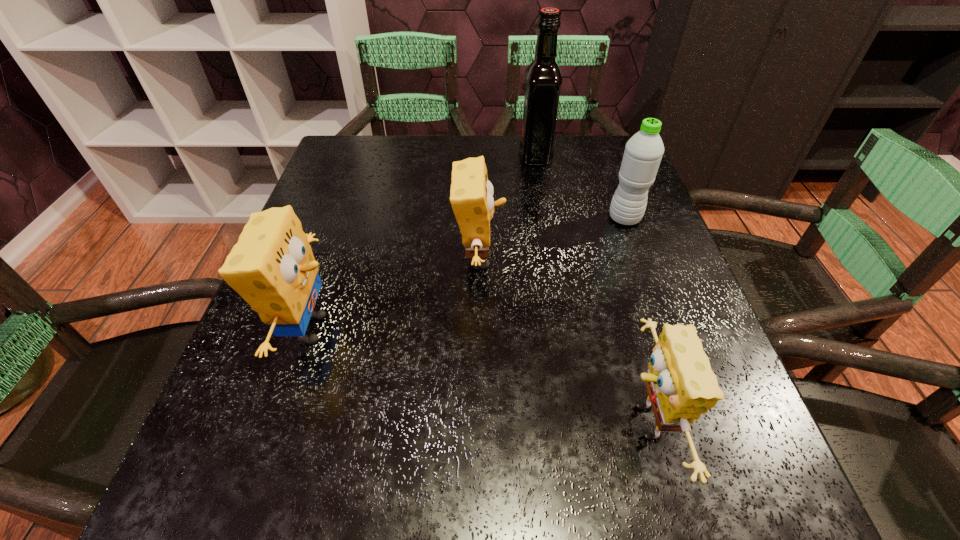
Locate an element on the screen. This screenshot has height=540, width=960. blank region between the rightmost sponge and the fourth object from right to left is located at coordinates (562, 341).

Where is `unoccupied position between the liquor and the shortest sponge`? unoccupied position between the liquor and the shortest sponge is located at coordinates (589, 289).

At what (x,y) coordinates should I click in order to perform the action: click on free space between the third object from left to right and the rightmost object. Please return your answer as a coordinate pair (x, y). Looking at the image, I should click on (580, 187).

Where is `free space between the third object from left to right and the leftmost object`? This screenshot has width=960, height=540. free space between the third object from left to right and the leftmost object is located at coordinates (423, 242).

Locate an element on the screen. The image size is (960, 540). unoccupied area between the fourth object from right to left and the second object from right to left is located at coordinates (562, 341).

You are a GUI agent. You are given a task and a screenshot of the screen. Output one action in this format:
    pyautogui.click(x=<x>, y=<y>)
    Task: Click on the free spot between the second sponge from right to left and the leftmost object
    
    Given the screenshot: What is the action you would take?
    pyautogui.click(x=395, y=294)

The width and height of the screenshot is (960, 540). Find the location of `free space between the tallest object and the rightmost object`. free space between the tallest object and the rightmost object is located at coordinates (580, 187).

The image size is (960, 540). Find the location of `the closest object to the second object from left to right`. the closest object to the second object from left to right is located at coordinates (272, 267).

Identify the location of object identified as the fourth closest to the rightmost object. (272, 267).

Locate an element on the screen. This screenshot has height=540, width=960. sponge that can be found as the closest to the second object from left to right is located at coordinates (272, 267).